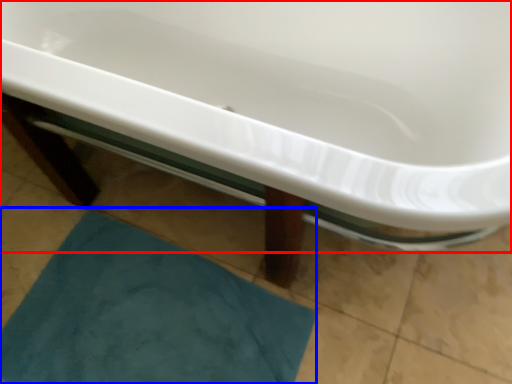
Question: Which point is closer to the camera, bathtub (highlighted by a red box) or bath mat (highlighted by a blue box)?

Choices:
 (A) bathtub
 (B) bath mat

Answer: (A)